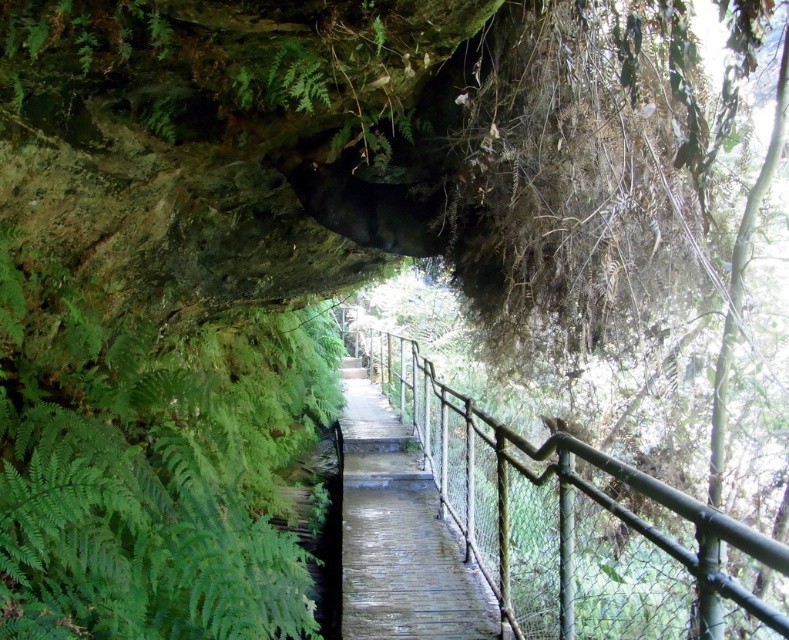
Looking at this image, can you confirm if green leafy ferns at left is positioned to the left of wooden bridge at center?

Correct, you'll find green leafy ferns at left to the left of wooden bridge at center.

Can you confirm if green leafy ferns at left is wider than wooden bridge at center?

Indeed, green leafy ferns at left has a greater width compared to wooden bridge at center.

Who is more distant from viewer, (212, 493) or (350, 524)?

Point (350, 524)

Find the location of a particular element. This screenshot has height=640, width=789. green leafy ferns at left is located at coordinates (148, 467).

Which is in front, point (264, 483) or point (473, 520)?

Point (473, 520) is more forward.

From the picture: Is green leafy ferns at left wider than green metal/rusty rail at center?

Yes, green leafy ferns at left is wider than green metal/rusty rail at center.

Between point (185, 573) and point (584, 550), which one is positioned behind?

The point (584, 550) is more distant.

I want to click on green leafy ferns at left, so click(x=148, y=467).

Based on the photo, measure the distance between green metal/rusty rail at center and camera.

green metal/rusty rail at center and camera are 36.31 inches apart.

Who is higher up, green metal/rusty rail at center or wooden bridge at center?

green metal/rusty rail at center

Where is `green metal/rusty rail at center`? The image size is (789, 640). green metal/rusty rail at center is located at coordinates (578, 525).

Find the location of `green metal/rusty rail at center`. green metal/rusty rail at center is located at coordinates (578, 525).